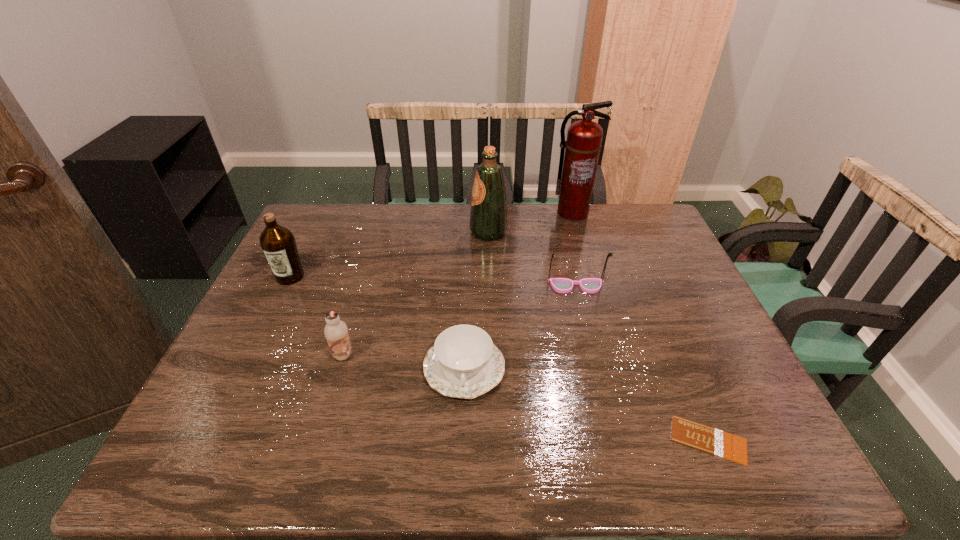
What are the coordinates of `the tallest object` in the screenshot? It's located at (582, 148).

At what (x,y) coordinates should I click in order to perform the action: click on the farthest object. Please return your answer as a coordinate pair (x, y). Looking at the image, I should click on (582, 148).

Where is `the farther olive oil`? Image resolution: width=960 pixels, height=540 pixels. the farther olive oil is located at coordinates (488, 219).

This screenshot has width=960, height=540. I want to click on the right olive oil, so click(x=488, y=219).

The image size is (960, 540). I want to click on the left olive oil, so click(x=277, y=242).

Find the location of a particular element. The image size is (960, 540). the nearer olive oil is located at coordinates (277, 242).

Locate an element on the screen. chocolate milk is located at coordinates (336, 332).

At what (x,y) coordinates should I click in order to perform the action: click on spectacles. Please return your answer as a coordinate pair (x, y). This screenshot has width=960, height=540. Looking at the image, I should click on (561, 285).

The height and width of the screenshot is (540, 960). Identify the location of chinaware. (464, 363).

You are a GUI agent. You are given a task and a screenshot of the screen. Output one action in this format:
    pyautogui.click(x=<x>, y=<y>)
    Task: Click on the chocolate bar
    The image size is (960, 540).
    Given the screenshot: What is the action you would take?
    pyautogui.click(x=708, y=439)